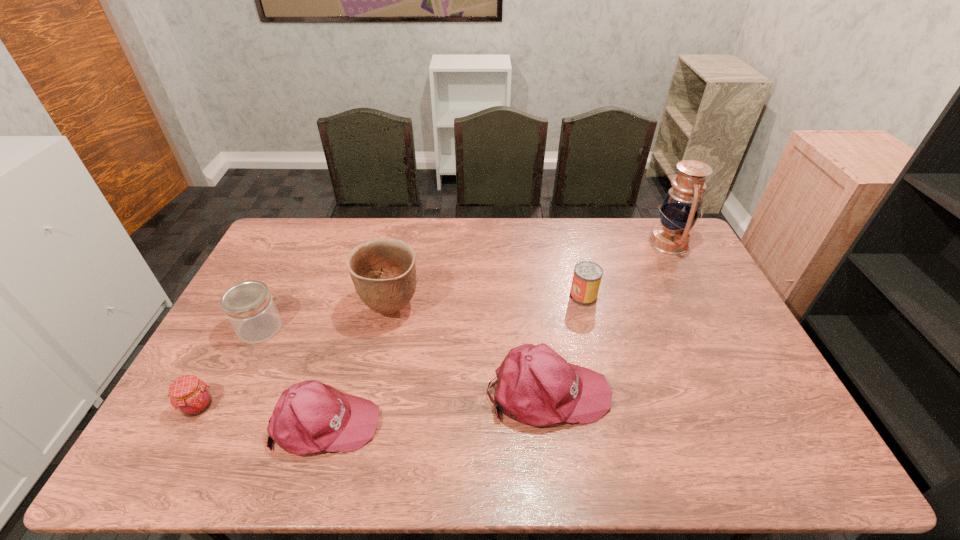
Locate an element on the screen. free space between the sixth shortest object and the jar is located at coordinates (325, 318).

The image size is (960, 540). I want to click on vacant space in between the jar and the can, so click(x=421, y=312).

This screenshot has width=960, height=540. I want to click on blank region between the can and the shorter baseball cap, so (454, 359).

Image resolution: width=960 pixels, height=540 pixels. I want to click on vacant space in between the rightmost object and the right baseball cap, so click(609, 318).

Where is `unoccupied area between the jam and the jar`? unoccupied area between the jam and the jar is located at coordinates (229, 367).

In order to click on vacant space that's between the shorter baseball cap and the oil lamp in this screenshot , I will do `click(497, 333)`.

Find the location of a particular element. This screenshot has height=540, width=960. object identified as the fourth closest to the jam is located at coordinates (535, 385).

Find the location of a particular element. the sixth closest object relative to the can is located at coordinates (189, 395).